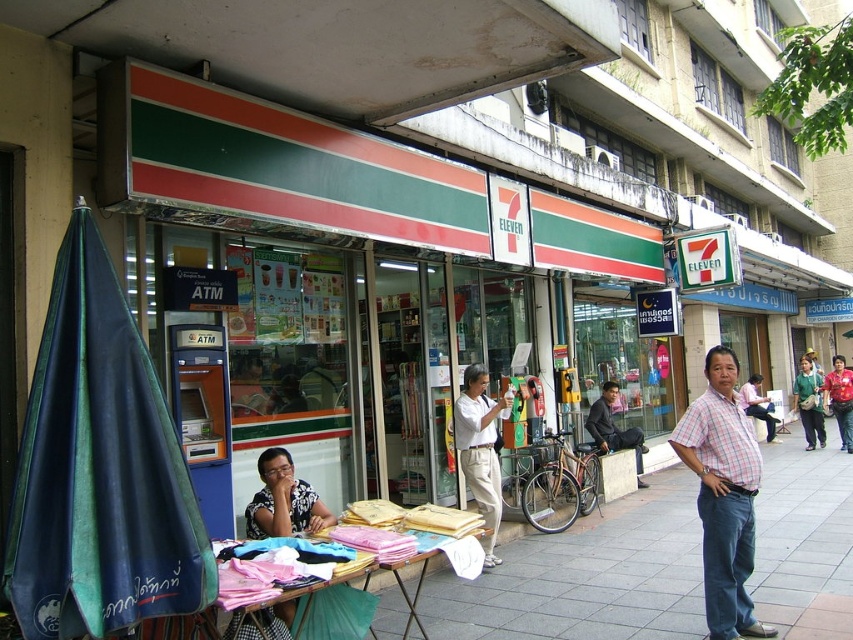
Between smooth concrete pavement at center and white matte shirt at center, which one has more height?

Standing taller between the two is white matte shirt at center.

Does smooth concrete pavement at center lie behind white matte shirt at center?

That is False.

Who is more forward, (596, 572) or (460, 435)?

Positioned in front is point (596, 572).

You are a GUI agent. You are given a task and a screenshot of the screen. Output one action in this format:
    pyautogui.click(x=<x>, y=<y>)
    Task: Click on the smooth concrete pavement at center
    
    Given the screenshot: What is the action you would take?
    587,577

Is smooth concrete pavement at center in front of patterned fabric at center?

That is False.

Which of these two, smooth concrete pavement at center or patterned fabric at center, stands shorter?

Standing shorter between the two is smooth concrete pavement at center.

Between point (525, 540) and point (312, 520), which one is positioned behind?

The point (525, 540) is more distant.

The image size is (853, 640). I want to click on smooth concrete pavement at center, so click(587, 577).

Who is higher up, patterned fabric at center or dark gray pants at center?

patterned fabric at center

Which is in front, point (310, 531) or point (606, 392)?

Point (310, 531)

Where is `patterned fabric at center`? Image resolution: width=853 pixels, height=640 pixels. patterned fabric at center is located at coordinates (283, 500).